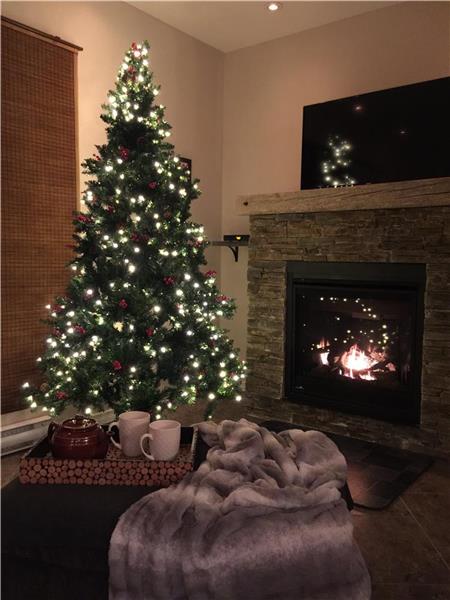
Where is `tv`? The image size is (450, 600). tv is located at coordinates (389, 160).